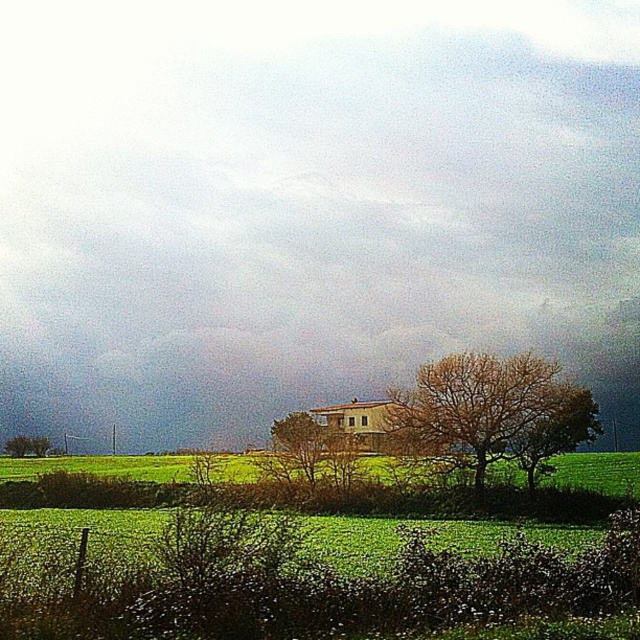
Question: Does bare branches at center appear over green leafy tree at lower left?

Choices:
 (A) yes
 (B) no

Answer: (A)

Question: Based on their relative distances, which object is nearer to the green leafy tree at lower left?

Choices:
 (A) bare branches at center
 (B) cloudy sky at center

Answer: (B)

Question: Which of the following is the closest to the observer?

Choices:
 (A) (38, 150)
 (B) (44, 445)
 (C) (493, 371)

Answer: (C)

Question: Estimate the real-world distances between objects in this image. Which object is closer to the cloudy sky at center?

Choices:
 (A) bare branches at center
 (B) green leafy tree at lower left

Answer: (B)

Question: Observing the image, what is the correct spatial positioning of cloudy sky at center in reference to green leafy tree at lower left?

Choices:
 (A) below
 (B) above

Answer: (B)

Question: Considering the relative positions of cloudy sky at center and green leafy tree at lower left in the image provided, where is cloudy sky at center located with respect to green leafy tree at lower left?

Choices:
 (A) left
 (B) right

Answer: (B)